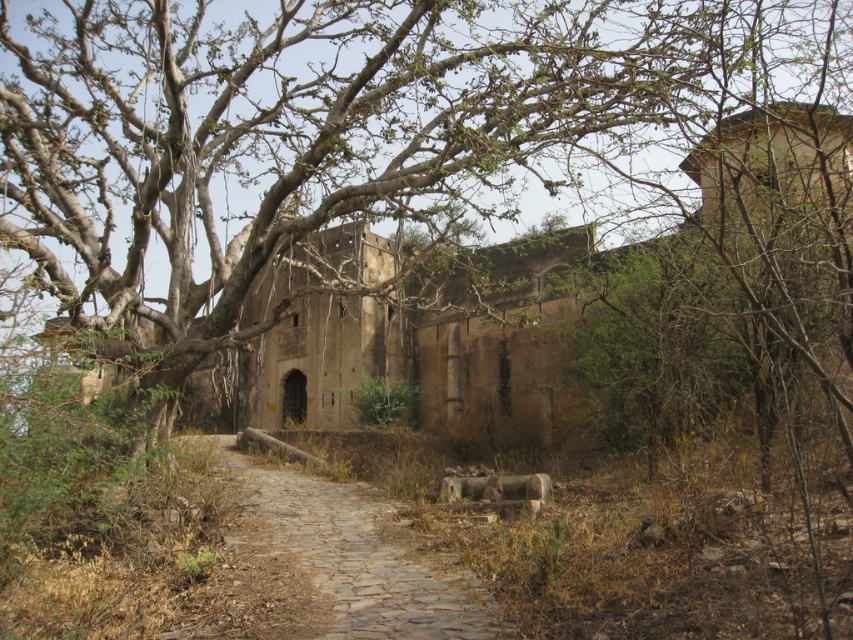
You are a hiker who wants to walk along the brown stone path at center without stepping on the rusty metallic barrel at center. Based on the scene, is the path wide enough for you to avoid the barrel?

The brown stone path at center has a lesser height compared to rusty metallic barrel at center, which means the barrel is taller than the path. Since the path is lower, you can walk around or step over the barrel to avoid it.

You are a hiker carrying a backpack weighing 20 kilograms. You are standing on the cobblestone path leading to the old building. You see the brown stone path at center and the rusty metallic barrel at center. How far apart are these two objects?

The brown stone path at center and the rusty metallic barrel at center are 10.35 meters apart from each other.